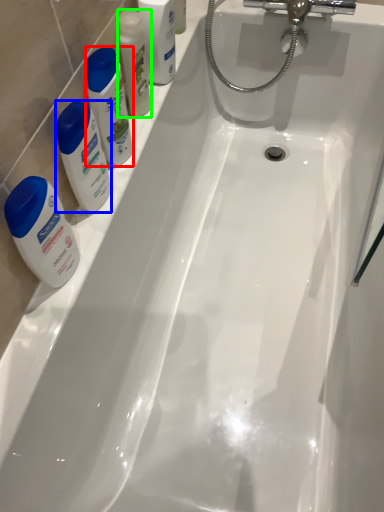
Question: Based on their relative distances, which object is farther from cleaning product (highlighted by a red box)? Choose from cleaning product (highlighted by a blue box) and mouthwash (highlighted by a green box).

Choices:
 (A) cleaning product
 (B) mouthwash

Answer: (B)